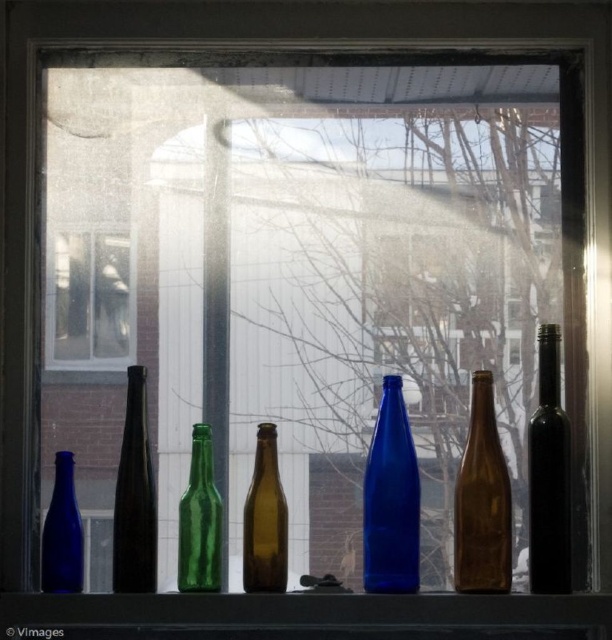
Question: Which point appears farthest from the camera in this image?

Choices:
 (A) (558, 564)
 (B) (211, 566)

Answer: (B)

Question: Which of the following is the farthest from the observer?

Choices:
 (A) black glass bottle at right
 (B) brown matte glass bottle at center
 (C) matte blue bottle at left

Answer: (C)

Question: Can you confirm if matte blue glass bottle at center is thinner than brown matte glass bottle at center?

Choices:
 (A) yes
 (B) no

Answer: (A)

Question: Is brown matte glass bottle at center to the left of black glass bottle at right from the viewer's perspective?

Choices:
 (A) no
 (B) yes

Answer: (B)

Question: Does matte blue glass bottle at center have a smaller size compared to matte blue bottle at left?

Choices:
 (A) yes
 (B) no

Answer: (B)

Question: Which point is farther to the camera?

Choices:
 (A) green glass bottle at center
 (B) matte blue bottle at left

Answer: (A)